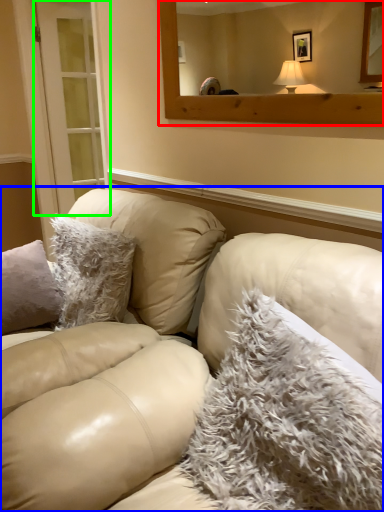
Question: Which object is positioned closest to mirror (highlighted by a red box)? Select from studio couch (highlighted by a blue box) and glass door (highlighted by a green box).

Choices:
 (A) studio couch
 (B) glass door

Answer: (A)